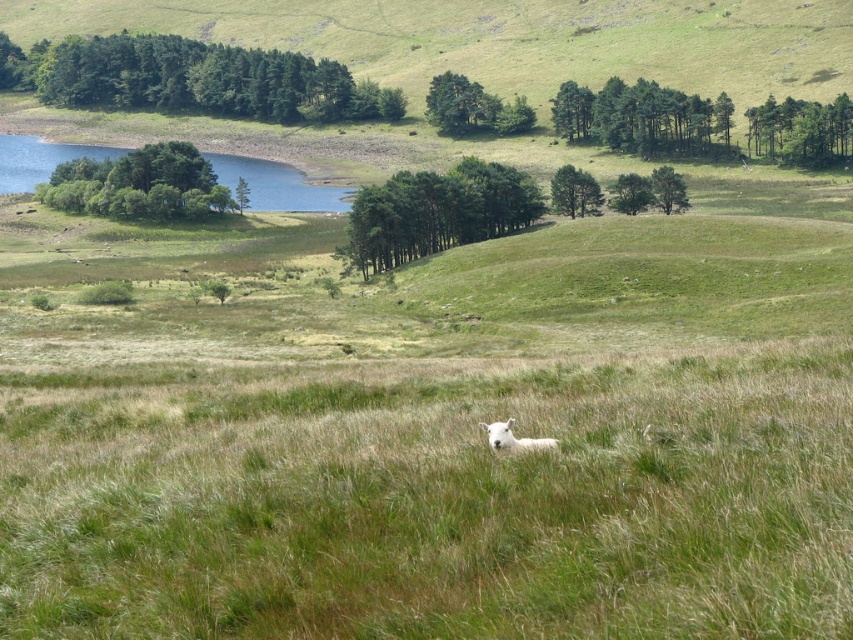
Is point (680, 65) in front of point (567, 211)?

That is False.

You are a GUI agent. You are given a task and a screenshot of the screen. Output one action in this format:
    pyautogui.click(x=<x>, y=<y>)
    Task: Click on the green grassy hillside at upper center
    
    Given the screenshot: What is the action you would take?
    pyautogui.click(x=505, y=38)

Is green grassy hillside at upper center below white woolly sheep at center?

No, green grassy hillside at upper center is not below white woolly sheep at center.

Is green grassy hillside at upper center to the left of white woolly sheep at center from the viewer's perspective?

Yes, green grassy hillside at upper center is to the left of white woolly sheep at center.

I want to click on green grassy hillside at upper center, so click(x=505, y=38).

Can you confirm if green leafy trees at center is positioned to the right of green matte trees at center?

In fact, green leafy trees at center is to the left of green matte trees at center.

Which is in front, point (479, 198) or point (619, 108)?

Positioned in front is point (479, 198).

At what (x,y) coordinates should I click in order to perform the action: click on green leafy trees at center. Please return your answer as a coordinate pair (x, y). Looking at the image, I should click on (436, 212).